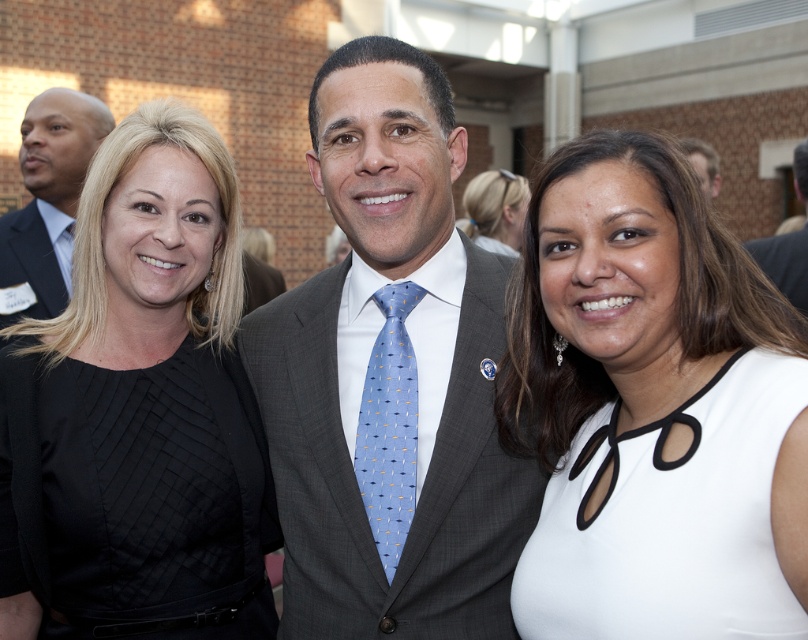
Question: Among these objects, which one is farthest from the camera?

Choices:
 (A) light blue silk tie at center
 (B) matte gray suit at center
 (C) black pleated dress at left
 (D) dark gray suit at left

Answer: (B)

Question: Considering the real-world distances, which object is farthest from the dark gray suit at left?

Choices:
 (A) matte black suit at left
 (B) gray suit at center
 (C) light blue silk tie at center
 (D) light brown hair at center

Answer: (D)

Question: Is black pleated dress at left to the left of light brown hair at center from the viewer's perspective?

Choices:
 (A) no
 (B) yes

Answer: (B)

Question: Which point is closer to the camera?

Choices:
 (A) light brown hair at center
 (B) white matte dress at center
 (C) blonde hair at upper center

Answer: (B)

Question: Can you confirm if gray suit at center is bigger than light blue silk tie at center?

Choices:
 (A) yes
 (B) no

Answer: (A)

Question: From the image, what is the correct spatial relationship of white matte dress at center in relation to matte gray suit at center?

Choices:
 (A) below
 (B) above

Answer: (A)